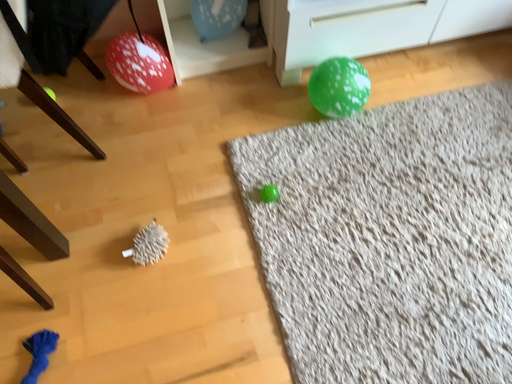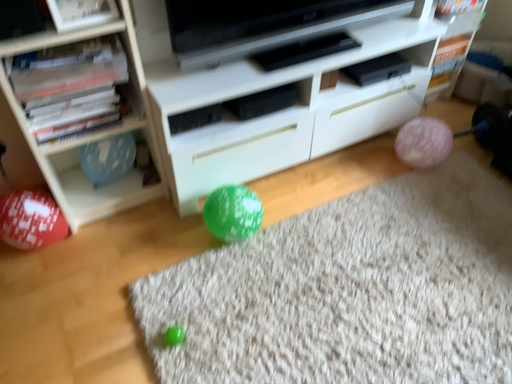
Question: Which way did the camera rotate in the video?

Choices:
 (A) rotated downward
 (B) rotated upward

Answer: (B)